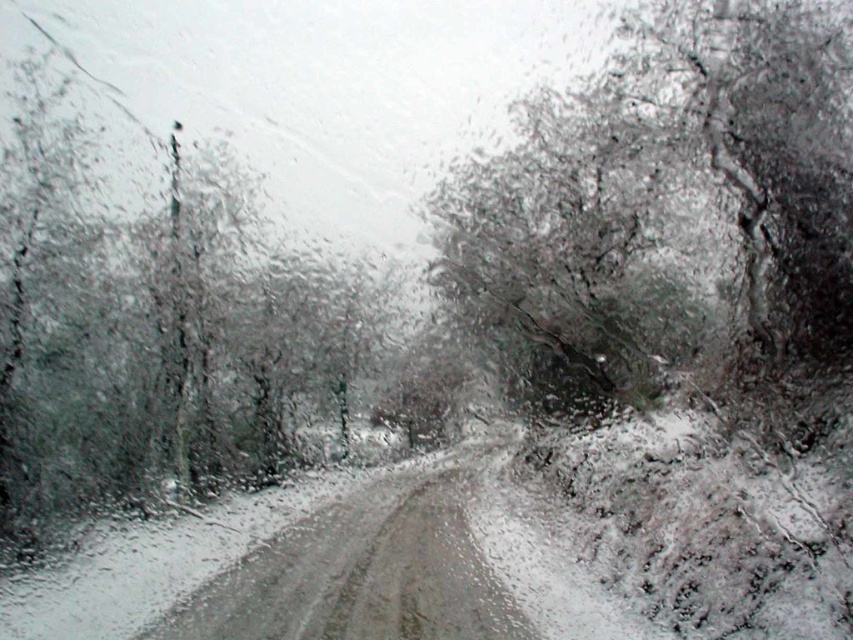
You are a driver trying to navigate through a narrow snowy road. You notice two trees outside your window, the snowy bark tree at upper right and the dark green textured tree at left. Which tree would appear taller in your view?

Answer: The dark green textured tree at left appears taller than the snowy bark tree at upper right because it is taller according to the description.

You are a passenger in a car driving through a snowy forest. You notice two trees outside the window. The snowy bark tree at upper right and the dark green textured tree at left. Which tree is higher up in your field of view?

The snowy bark tree at upper right is higher up in your field of view because it is positioned above the dark green textured tree at left.

You are a driver navigating through a snowstorm and see the snowy bark tree at upper right in your vehicle windshield. Based on its position at upper right, can you estimate its 2D coordinates on the windshield?

The snowy bark tree at upper right is located at the 2D coordinates of point (x=666, y=211) on the windshield.